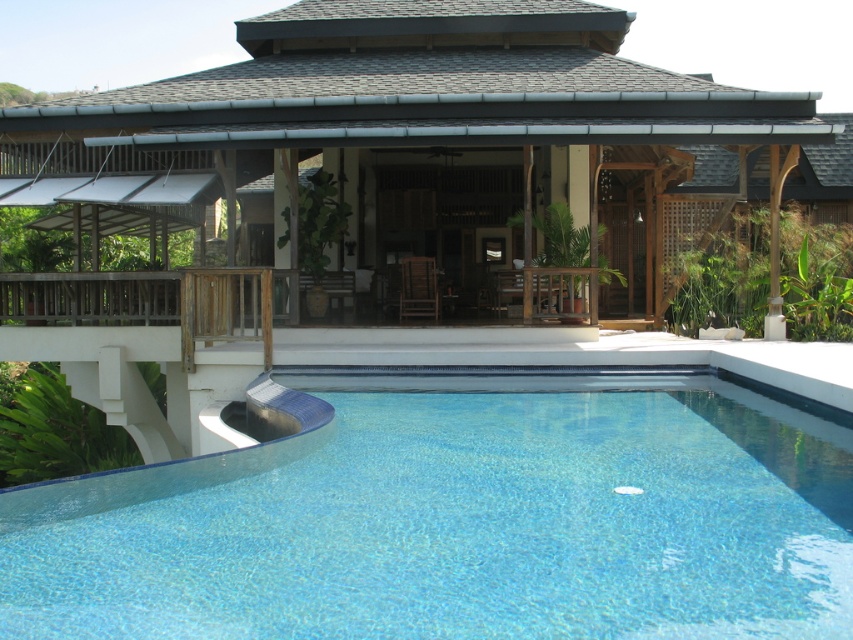
Question: Is blue tile pool at lower center positioned behind clear glass pool at center?

Choices:
 (A) yes
 (B) no

Answer: (A)

Question: Can you confirm if blue tile pool at lower center is positioned below clear glass pool at center?

Choices:
 (A) no
 (B) yes

Answer: (A)

Question: Among these objects, which one is farthest from the camera?

Choices:
 (A) clear glass pool at center
 (B) blue tile pool at lower center

Answer: (B)

Question: Which of the following is the farthest from the observer?

Choices:
 (A) tap(755, 532)
 (B) tap(192, 132)

Answer: (B)

Question: Is blue tile pool at lower center to the left of clear glass pool at center from the viewer's perspective?

Choices:
 (A) no
 (B) yes

Answer: (A)